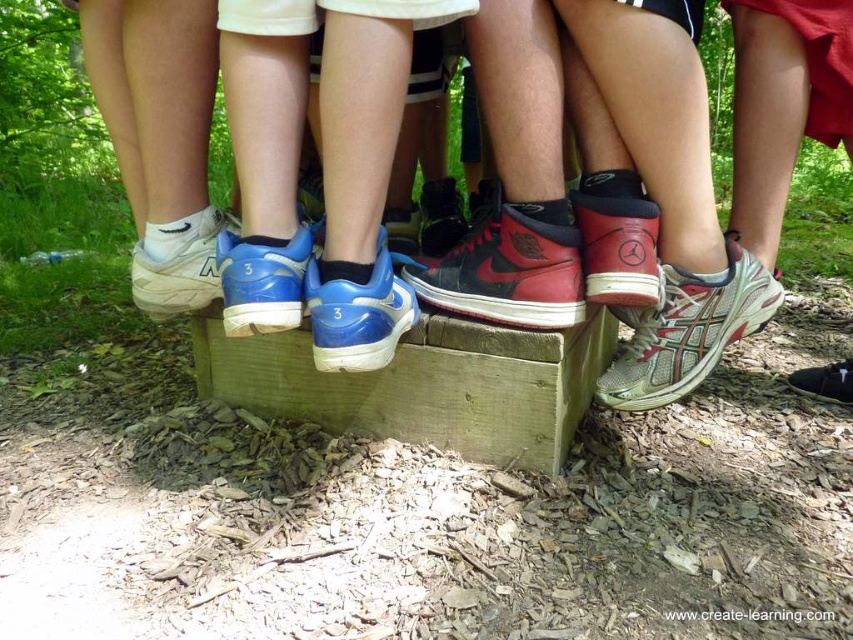
You are a park maintenance worker checking the seating area. You need to place a shiny red leather sneaker at center on the wooden bench at center. Can the bench accommodate the sneaker?

The wooden bench at center is wider than the shiny red leather sneaker at center, so the bench can accommodate the sneaker.

You are a park maintenance worker checking the wooden bench at center and the blue matte running shoe at center. Which object takes up more space in the image?

The wooden bench at center is larger in size than the blue matte running shoe at center, so it takes up more space in the image.